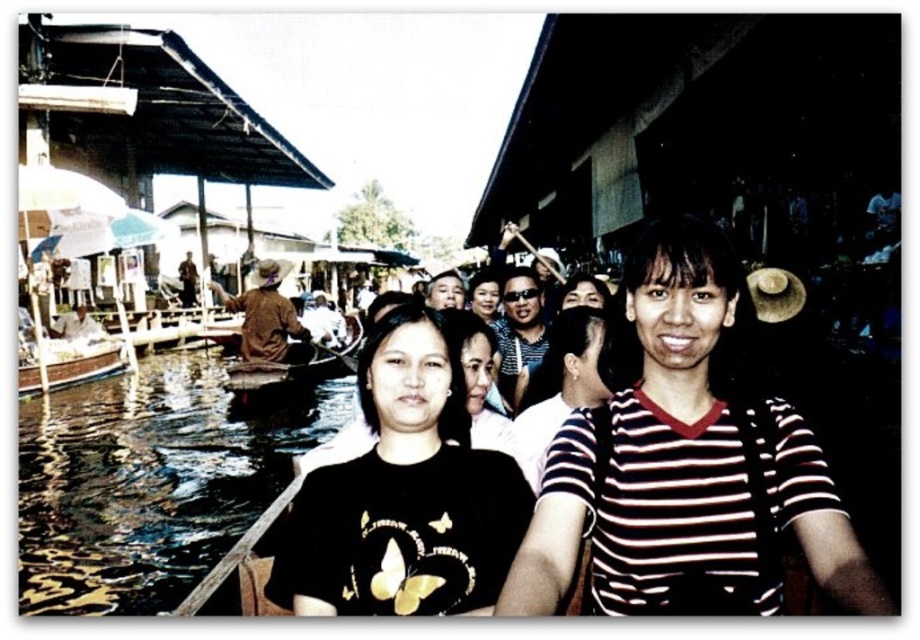
Question: Estimate the real-world distances between objects in this image. Which object is farther from the brown clothed man at left?

Choices:
 (A) clear water at lower left
 (B) matte black hair at center
 (C) striped cotton shirt at center

Answer: (C)

Question: Can you confirm if brown clothed man at left is thinner than matte black shirt at center?

Choices:
 (A) yes
 (B) no

Answer: (B)

Question: Estimate the real-world distances between objects in this image. Which object is farther from the brown wooden paddle at lower left?

Choices:
 (A) brown clothed man at left
 (B) brown leather hat at upper center
 (C) matte black hair at center
 (D) striped fabric at center

Answer: (C)

Question: Is striped cotton shirt at center closer to camera compared to brown leather hat at upper center?

Choices:
 (A) no
 (B) yes

Answer: (B)

Question: Can you confirm if striped cotton shirt at center is positioned above wooden boat at left?

Choices:
 (A) no
 (B) yes

Answer: (B)

Question: Among these points, which one is farthest from the camera?

Choices:
 (A) (294, 362)
 (B) (587, 284)
 (C) (445, 288)
 (D) (512, 536)

Answer: (A)